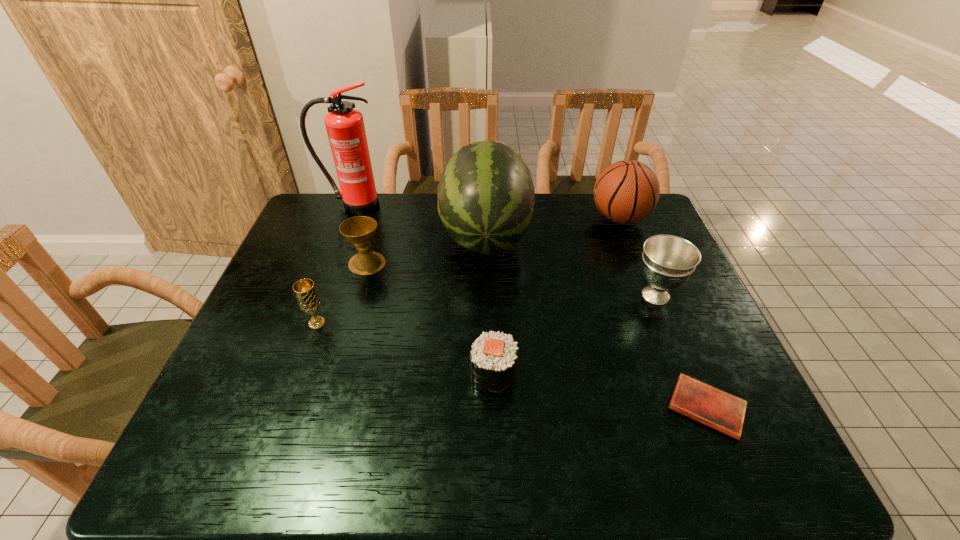
Where is `object at the far right corner`? This screenshot has width=960, height=540. object at the far right corner is located at coordinates click(x=627, y=191).

Where is `object that is positioned at the near right corner`? object that is positioned at the near right corner is located at coordinates (724, 412).

Locate an element on the screen. Image resolution: width=960 pixels, height=540 pixels. vacant space at the far edge is located at coordinates (390, 204).

In order to click on blank space at the near edge in this screenshot , I will do `click(427, 439)`.

Image resolution: width=960 pixels, height=540 pixels. In the image, there is a desktop. Identify the location of vacant area at the left edge. (235, 406).

This screenshot has width=960, height=540. I want to click on vacant space at the right edge, so click(x=645, y=316).

Locate an element on the screen. free space between the second shortest object and the seventh shortest object is located at coordinates (490, 305).

Identify the location of free space between the basketball and the shortest object. The width and height of the screenshot is (960, 540). (663, 313).

What are the coordinates of `vacant area that lies between the sushi and the basketball` in the screenshot? It's located at (557, 297).

You are a GUI agent. You are given a task and a screenshot of the screen. Output one action in this format:
    pyautogui.click(x=<x>, y=<y>)
    Task: Click on the vacant point located between the third nearest object and the third tallest object
    This screenshot has height=540, width=960.
    Given the screenshot: What is the action you would take?
    pyautogui.click(x=468, y=271)